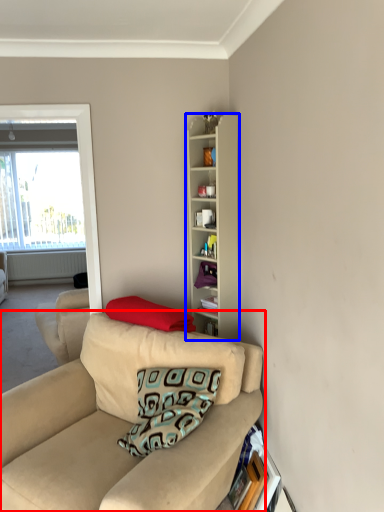
Question: Which of the following is the farthest to the observer, studio couch (highlighted by a red box) or cabinetry (highlighted by a blue box)?

Choices:
 (A) studio couch
 (B) cabinetry

Answer: (B)